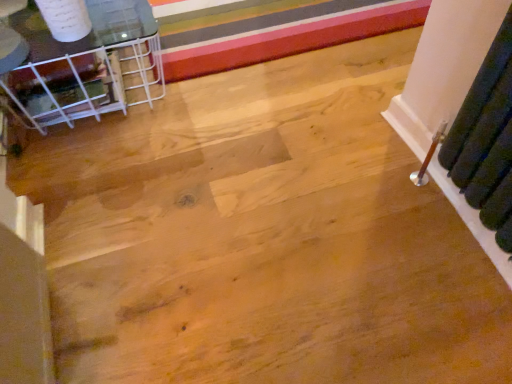
Question: From the image's perspective, is clear glass table at upper left located beneath multicolored striped carpet at upper center?

Choices:
 (A) no
 (B) yes

Answer: (B)

Question: From the image's perspective, is clear glass table at upper left above multicolored striped carpet at upper center?

Choices:
 (A) yes
 (B) no

Answer: (B)

Question: Can you confirm if clear glass table at upper left is thinner than multicolored striped carpet at upper center?

Choices:
 (A) yes
 (B) no

Answer: (A)

Question: Does clear glass table at upper left have a greater width compared to multicolored striped carpet at upper center?

Choices:
 (A) no
 (B) yes

Answer: (A)

Question: Is clear glass table at upper left far from multicolored striped carpet at upper center?

Choices:
 (A) yes
 (B) no

Answer: (B)

Question: Does clear glass table at upper left appear on the left side of multicolored striped carpet at upper center?

Choices:
 (A) no
 (B) yes

Answer: (B)

Question: Is multicolored striped carpet at upper center bigger than clear glass table at upper left?

Choices:
 (A) yes
 (B) no

Answer: (B)

Question: Does multicolored striped carpet at upper center lie in front of clear glass table at upper left?

Choices:
 (A) no
 (B) yes

Answer: (A)

Question: Is multicolored striped carpet at upper center smaller than clear glass table at upper left?

Choices:
 (A) no
 (B) yes

Answer: (B)

Question: Is multicolored striped carpet at upper center positioned far away from clear glass table at upper left?

Choices:
 (A) no
 (B) yes

Answer: (A)

Question: Can you confirm if multicolored striped carpet at upper center is positioned to the right of clear glass table at upper left?

Choices:
 (A) no
 (B) yes

Answer: (B)

Question: Is multicolored striped carpet at upper center shorter than clear glass table at upper left?

Choices:
 (A) no
 (B) yes

Answer: (B)

Question: Is clear glass table at upper left wider or thinner than multicolored striped carpet at upper center?

Choices:
 (A) thin
 (B) wide

Answer: (A)